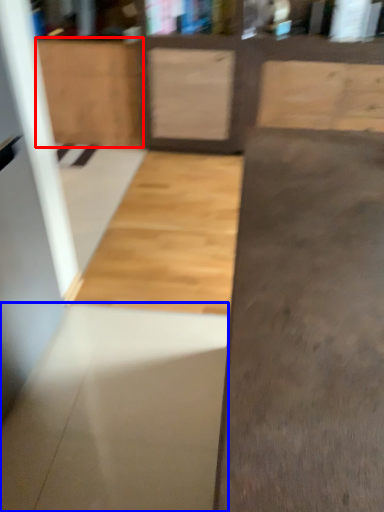
Question: Which of the following is the closest to the observer, cabinetry (highlighted by a red box) or concrete (highlighted by a blue box)?

Choices:
 (A) cabinetry
 (B) concrete

Answer: (B)